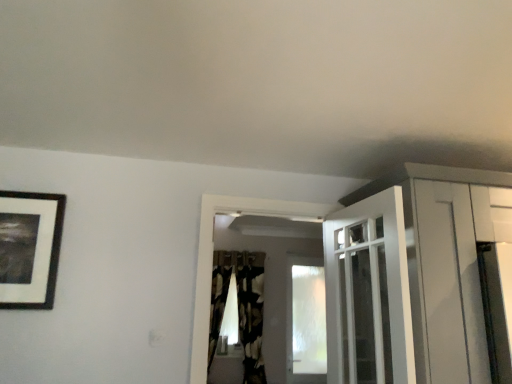
Image resolution: width=512 pixels, height=384 pixels. What do you see at coordinates (240, 308) in the screenshot?
I see `black textured curtain at center` at bounding box center [240, 308].

Describe the element at coordinates (368, 293) in the screenshot. This screenshot has width=512, height=384. I see `white glossy door at upper center` at that location.

Locate an element on the screen. transparent frosted glass window at center is located at coordinates (308, 320).

Can you confirm if transparent frosted glass window at center is thinner than black textured curtain at center?

Yes.

What's the angular difference between transparent frosted glass window at center and black textured curtain at center's facing directions?

There is a 0.58-degree angle between the facing directions of transparent frosted glass window at center and black textured curtain at center.

I want to click on window directly beneath the black textured curtain at center (from a real-world perspective), so click(x=308, y=320).

Measure the distance from white glossy door at upper center to black matte picture frame at upper left.

1.59 meters.

Consider the image. Can you tell me how much white glossy door at upper center and black matte picture frame at upper left differ in facing direction?

The facing directions of white glossy door at upper center and black matte picture frame at upper left are 88 degrees apart.

Which of these two, white glossy door at upper center or black matte picture frame at upper left, is smaller?

black matte picture frame at upper left.

Is there a large distance between white glossy door at upper center and black matte picture frame at upper left?

Yes, white glossy door at upper center is far from black matte picture frame at upper left.

Considering the points (251, 324) and (383, 357), which point is in front, point (251, 324) or point (383, 357)?

The point (383, 357) is closer.

Could you tell me if black textured curtain at center is turned towards white glossy door at upper center?

Yes.

Based on the photo, is black textured curtain at center completely or partially outside of white glossy door at upper center?

Yes, black textured curtain at center is located beyond the bounds of white glossy door at upper center.

Where is `window on the right of black textured curtain at center`? This screenshot has width=512, height=384. window on the right of black textured curtain at center is located at coordinates (308, 320).

Is black textured curtain at center smaller than transparent frosted glass window at center?

Incorrect, black textured curtain at center is not smaller in size than transparent frosted glass window at center.

Is black textured curtain at center in front of or behind transparent frosted glass window at center in the image?

In the image, black textured curtain at center appears in front of transparent frosted glass window at center.

From a real-world perspective, between black textured curtain at center and transparent frosted glass window at center, who is vertically lower?

transparent frosted glass window at center, from a real-world perspective.

Is white glossy door at upper center positioned with its back to transparent frosted glass window at center?

No, white glossy door at upper center's orientation is not away from transparent frosted glass window at center.

In the image, is white glossy door at upper center positioned in front of or behind transparent frosted glass window at center?

white glossy door at upper center is in front of transparent frosted glass window at center.

How different are the orientations of white glossy door at upper center and transparent frosted glass window at center in degrees?

There is a 85.3-degree angle between the facing directions of white glossy door at upper center and transparent frosted glass window at center.

Does point (392, 202) lie in front of point (309, 368)?

Yes.

Is transparent frosted glass window at center at the back of black matte picture frame at upper left?

That's not correct — black matte picture frame at upper left is not looking away from transparent frosted glass window at center.

Does point (7, 233) lie behind point (295, 326)?

No, it is not.

From the image's perspective, which one is positioned higher, black matte picture frame at upper left or transparent frosted glass window at center?

black matte picture frame at upper left.

Considering the sizes of black matte picture frame at upper left and transparent frosted glass window at center in the image, is black matte picture frame at upper left wider or thinner than transparent frosted glass window at center?

In the image, black matte picture frame at upper left appears to be more narrow than transparent frosted glass window at center.

Does point (352, 349) come behind point (239, 345)?

No, it is not.

From a real-world perspective, is white glossy door at upper center located higher than black textured curtain at center?

Yes, from a real-world perspective, white glossy door at upper center is on top of black textured curtain at center.

Can you confirm if white glossy door at upper center is wider than black textured curtain at center?

Incorrect, the width of white glossy door at upper center does not surpass that of black textured curtain at center.

Can you confirm if white glossy door at upper center is bigger than black textured curtain at center?

Correct, white glossy door at upper center is larger in size than black textured curtain at center.

Identify the location of window that appears on the right of black textured curtain at center. This screenshot has height=384, width=512. (308, 320).

There is a white glossy door at upper center. Where is `picture frame above it (from a real-world perspective)`? picture frame above it (from a real-world perspective) is located at coordinates (x=29, y=248).

When comparing their distances from black matte picture frame at upper left, does white glossy door at upper center or transparent frosted glass window at center seem closer?

Based on the image, white glossy door at upper center appears to be nearer to black matte picture frame at upper left.

Estimate the real-world distances between objects in this image. Which object is closer to transparent frosted glass window at center, white glossy door at upper center or black matte picture frame at upper left?

Based on the image, white glossy door at upper center appears to be nearer to transparent frosted glass window at center.

Estimate the real-world distances between objects in this image. Which object is closer to white glossy door at upper center, black matte picture frame at upper left or black textured curtain at center?

The object closer to white glossy door at upper center is black matte picture frame at upper left.

When comparing their distances from black textured curtain at center, does white glossy door at upper center or transparent frosted glass window at center seem further?

white glossy door at upper center lies further to black textured curtain at center than the other object.

Which object lies further to the anchor point transparent frosted glass window at center, black matte picture frame at upper left or white glossy door at upper center?

black matte picture frame at upper left lies further to transparent frosted glass window at center than the other object.

Looking at the image, which one is located closer to black textured curtain at center, white glossy door at upper center or black matte picture frame at upper left?

white glossy door at upper center is positioned closer to the anchor black textured curtain at center.

Based on their spatial positions, is white glossy door at upper center or black textured curtain at center further from transparent frosted glass window at center?

white glossy door at upper center.

Estimate the real-world distances between objects in this image. Which object is closer to transparent frosted glass window at center, black textured curtain at center or black matte picture frame at upper left?

Based on the image, black textured curtain at center appears to be nearer to transparent frosted glass window at center.

This screenshot has height=384, width=512. What are the coordinates of `curtain located between black matte picture frame at upper left and transparent frosted glass window at center in the depth direction` in the screenshot? It's located at (240, 308).

Locate an element on the screen. picture frame between white glossy door at upper center and transparent frosted glass window at center from front to back is located at coordinates (29, 248).

In order to click on curtain between white glossy door at upper center and transparent frosted glass window at center along the z-axis in this screenshot , I will do `click(240, 308)`.

Find the location of a particular element. The image size is (512, 384). picture frame located between white glossy door at upper center and black textured curtain at center in the depth direction is located at coordinates (29, 248).